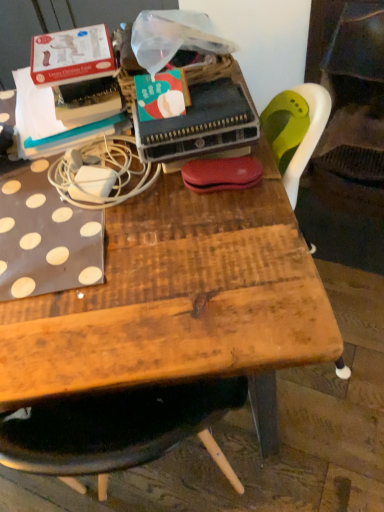
This screenshot has height=512, width=384. In order to click on free space in front of white matte power adapter at upper left in this screenshot , I will do `click(96, 244)`.